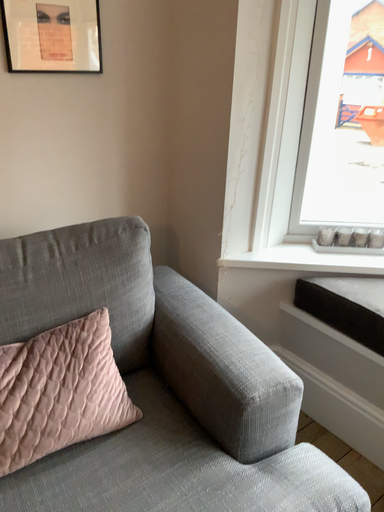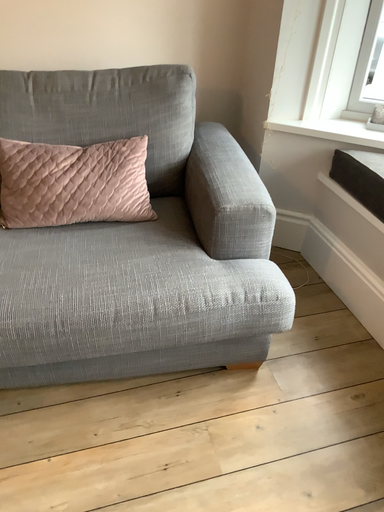
Question: How did the camera likely rotate when shooting the video?

Choices:
 (A) rotated upward
 (B) rotated downward

Answer: (B)